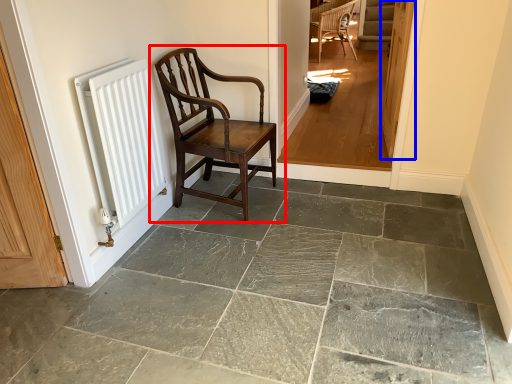
Question: Which point is further to the camera, chair (highlighted by a red box) or door (highlighted by a blue box)?

Choices:
 (A) chair
 (B) door

Answer: (B)